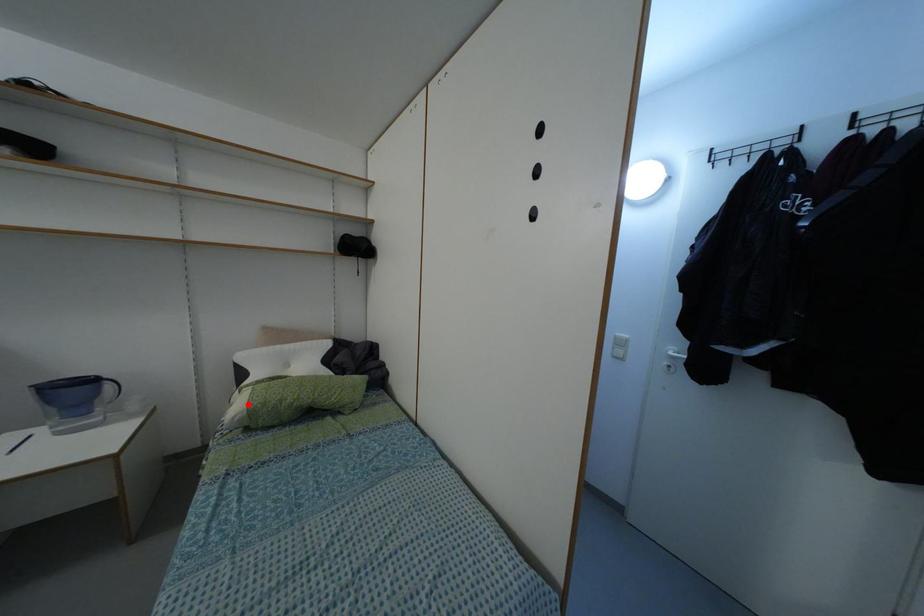
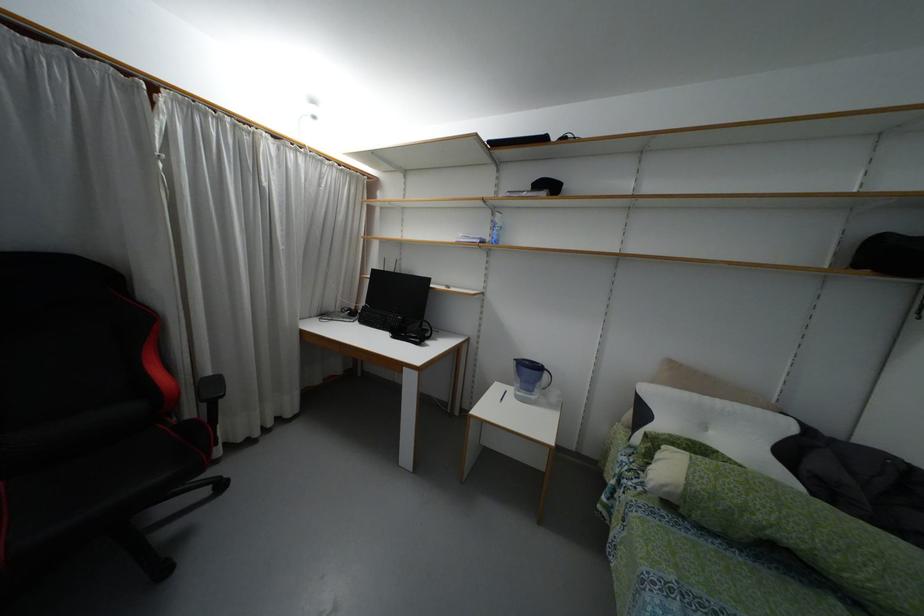
Find the pixel in the second image that matches the highlighted location in the first image.

(687, 483)